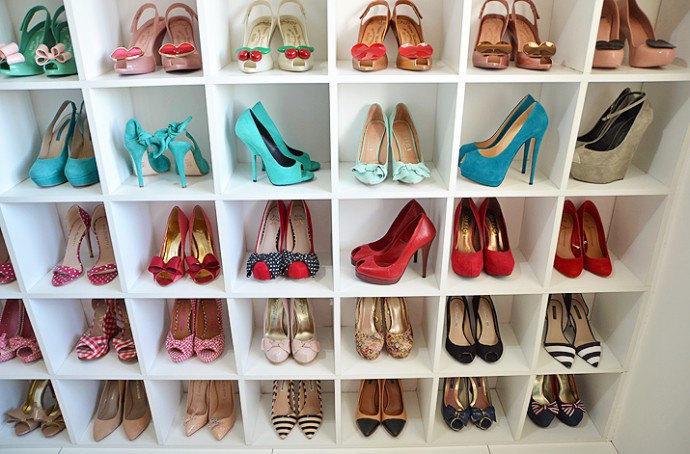
The image size is (690, 454). Identify the location of shoes in the rightmost cubbies. (606, 54), (651, 44), (593, 133), (610, 142), (573, 253), (595, 246), (562, 344), (588, 339), (544, 406), (571, 405).